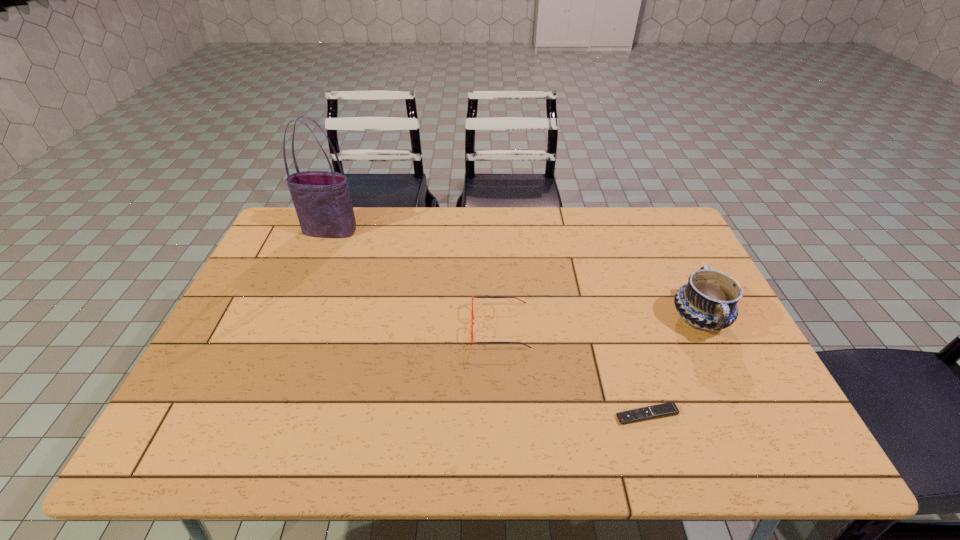
Where is `free spot located 0.390m on the front-facing side of the third object from right to left`? free spot located 0.390m on the front-facing side of the third object from right to left is located at coordinates (327, 327).

Locate an element on the screen. This screenshot has height=540, width=960. vacant space situated 0.320m on the front-facing side of the third object from right to left is located at coordinates (353, 327).

You are a GUI agent. You are given a task and a screenshot of the screen. Output one action in this format:
    pyautogui.click(x=<x>, y=<y>)
    Task: Click on the free location located 0.140m on the front-facing side of the third object from right to left
    The image size is (960, 540).
    Given the screenshot: What is the action you would take?
    pyautogui.click(x=420, y=327)

Locate an element on the screen. The image size is (960, 540). free space located on the back of the second object from right to left is located at coordinates (608, 285).

You are a GUI agent. You are given a task and a screenshot of the screen. Output one action in this format:
    pyautogui.click(x=<x>, y=<y>)
    Task: Click on the object that is at the far edge
    
    Given the screenshot: What is the action you would take?
    pyautogui.click(x=322, y=200)

The width and height of the screenshot is (960, 540). I want to click on object that is at the near edge, so click(666, 409).

Find the location of a particular element. This screenshot has height=540, width=960. object that is at the left edge is located at coordinates (322, 200).

Find the location of a particular element. This screenshot has width=960, height=540. object at the right edge is located at coordinates (708, 301).

Where is `object situated at the far left corner`? This screenshot has width=960, height=540. object situated at the far left corner is located at coordinates (322, 200).

Image resolution: width=960 pixels, height=540 pixels. Find the location of `vacant space at the far edge of the desktop`. vacant space at the far edge of the desktop is located at coordinates (508, 215).